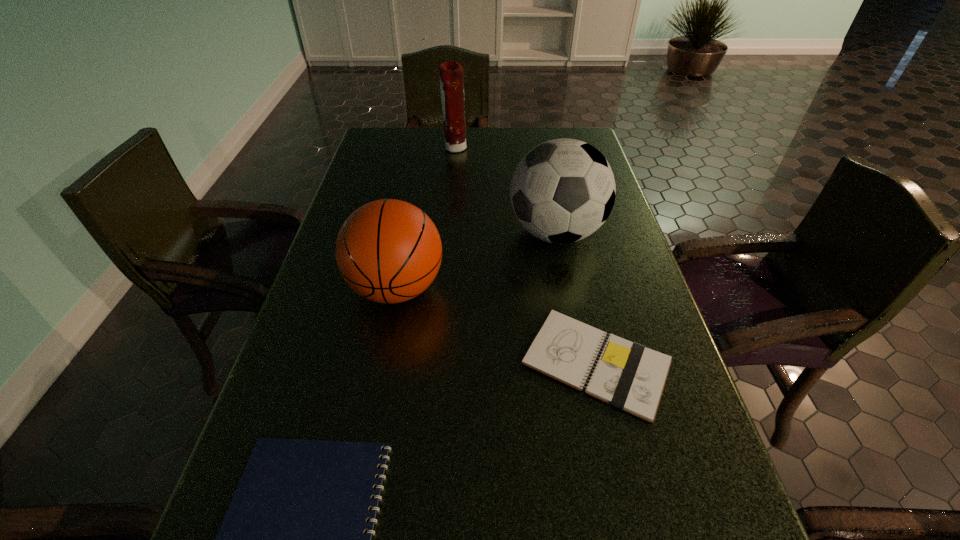
Find the location of a particular element. blank space located 0.150m on the left of the fourth tallest object is located at coordinates (444, 362).

Image resolution: width=960 pixels, height=540 pixels. Find the location of `object located at the far edge`. object located at the far edge is located at coordinates (451, 73).

This screenshot has height=540, width=960. In order to click on object situated at the left edge in this screenshot , I will do `click(389, 251)`.

Find the location of a particular element. soccer ball positioned at the right edge is located at coordinates (563, 190).

Identify the location of notepad situated at the right edge. 627,375.

Image resolution: width=960 pixels, height=540 pixels. I want to click on vacant space at the far edge, so click(492, 141).

Find the location of a particular element. The image size is (960, 540). free region at the left edge of the desktop is located at coordinates (299, 361).

At what (x,y) coordinates should I click in order to perform the action: click on free region at the right edge. Please return your answer as a coordinate pair (x, y). The width and height of the screenshot is (960, 540). Looking at the image, I should click on (690, 502).

Locate an element on the screen. vacant point at the far right corner is located at coordinates (595, 146).

The image size is (960, 540). In order to click on free space between the soccer ball and the condiment in this screenshot , I will do `click(506, 191)`.